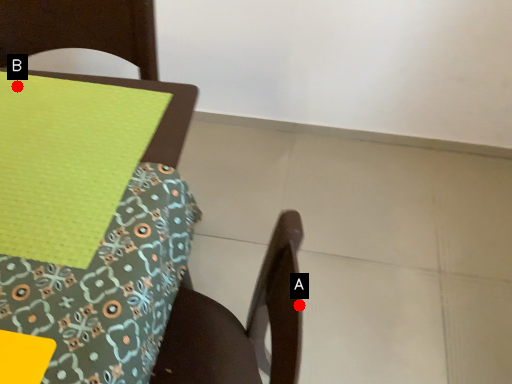
Question: Two points are circled on the image, labeled by A and B beside each circle. Which point is farther from the camera taking this photo?

Choices:
 (A) A is further
 (B) B is further

Answer: (B)